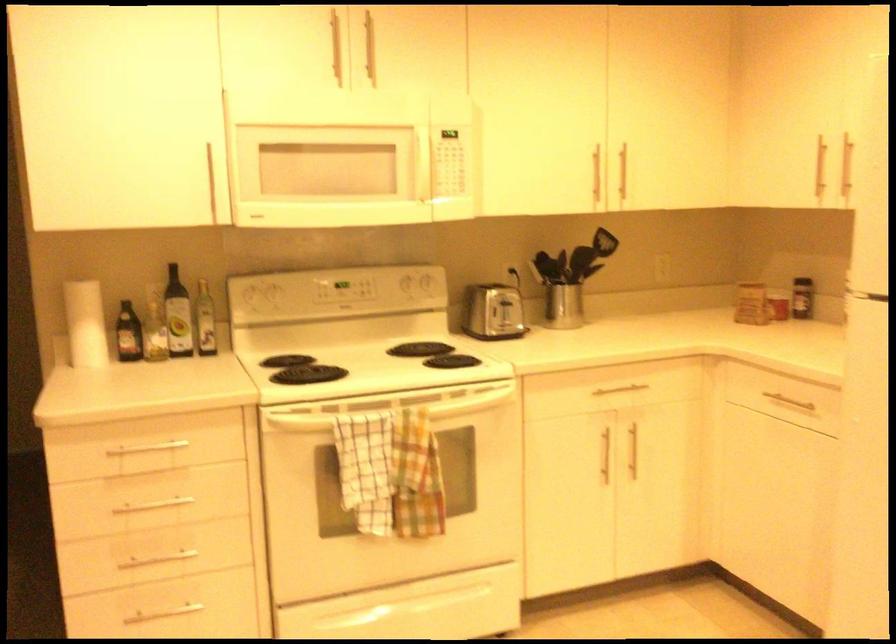
Where is `oven door handle`? The image size is (896, 644). oven door handle is located at coordinates (390, 424).